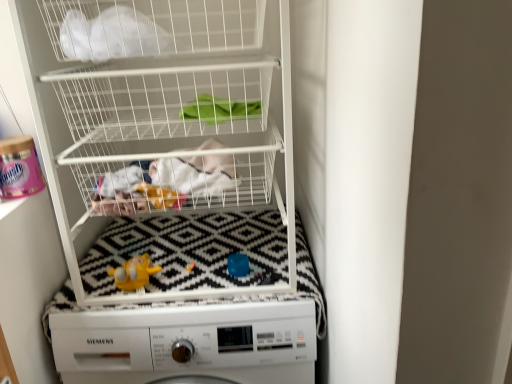
Question: Does white matte washing machine at center have a lesser width compared to white mesh bag at upper left?

Choices:
 (A) yes
 (B) no

Answer: (B)

Question: Would you say white matte washing machine at center contains white mesh bag at upper left?

Choices:
 (A) yes
 (B) no

Answer: (B)

Question: From a real-world perspective, is white matte washing machine at center located beneath white mesh bag at upper left?

Choices:
 (A) no
 (B) yes

Answer: (B)

Question: Is white matte washing machine at center smaller than white mesh bag at upper left?

Choices:
 (A) no
 (B) yes

Answer: (A)

Question: Is white matte washing machine at center outside white mesh bag at upper left?

Choices:
 (A) no
 (B) yes

Answer: (B)

Question: Is white matte washing machine at center not close to white mesh bag at upper left?

Choices:
 (A) yes
 (B) no

Answer: (B)

Question: Is white wire basket at upper center outside of white fabric at center?

Choices:
 (A) yes
 (B) no

Answer: (A)

Question: Is white wire basket at upper center positioned with its back to white fabric at center?

Choices:
 (A) no
 (B) yes

Answer: (B)

Question: Is white wire basket at upper center positioned far away from white fabric at center?

Choices:
 (A) yes
 (B) no

Answer: (B)

Question: From a real-world perspective, is white wire basket at upper center beneath white fabric at center?

Choices:
 (A) no
 (B) yes

Answer: (A)

Question: Considering the relative positions of white wire basket at upper center and white fabric at center in the image provided, is white wire basket at upper center to the right of white fabric at center from the viewer's perspective?

Choices:
 (A) yes
 (B) no

Answer: (B)

Question: From a real-world perspective, is white wire basket at upper center positioned over white fabric at center based on gravity?

Choices:
 (A) yes
 (B) no

Answer: (A)

Question: Is white wire basket at upper center in front of yellow rubber duck at center?

Choices:
 (A) no
 (B) yes

Answer: (B)